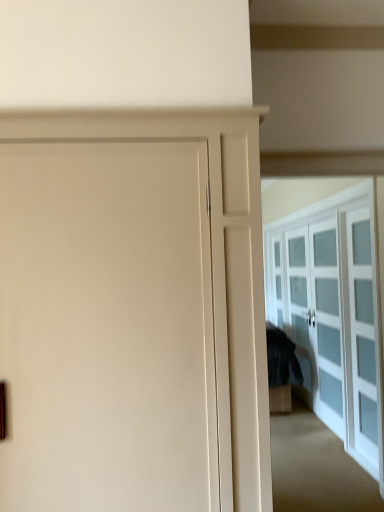
Question: Is white glass cabinet at right inside the boundaries of matte white door at center, or outside?

Choices:
 (A) inside
 (B) outside

Answer: (B)

Question: Considering the positions of point (311, 392) and point (168, 406), is point (311, 392) closer or farther from the camera than point (168, 406)?

Choices:
 (A) farther
 (B) closer

Answer: (A)

Question: From the image's perspective, is white glass cabinet at right above or below matte white door at center?

Choices:
 (A) above
 (B) below

Answer: (B)

Question: Would you say matte white door at center is to the left or to the right of white glass cabinet at right in the picture?

Choices:
 (A) left
 (B) right

Answer: (A)

Question: In terms of height, does matte white door at center look taller or shorter compared to white glass cabinet at right?

Choices:
 (A) tall
 (B) short

Answer: (A)

Question: Considering the positions of matte white door at center and white glass cabinet at right in the image, is matte white door at center wider or thinner than white glass cabinet at right?

Choices:
 (A) wide
 (B) thin

Answer: (A)

Question: From a real-world perspective, is matte white door at center physically located above or below white glass cabinet at right?

Choices:
 (A) above
 (B) below

Answer: (A)